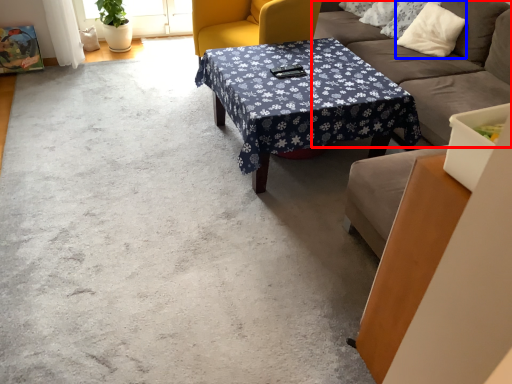
Question: Among these objects, which one is farthest to the camera, studio couch (highlighted by a red box) or pillow (highlighted by a blue box)?

Choices:
 (A) studio couch
 (B) pillow

Answer: (B)